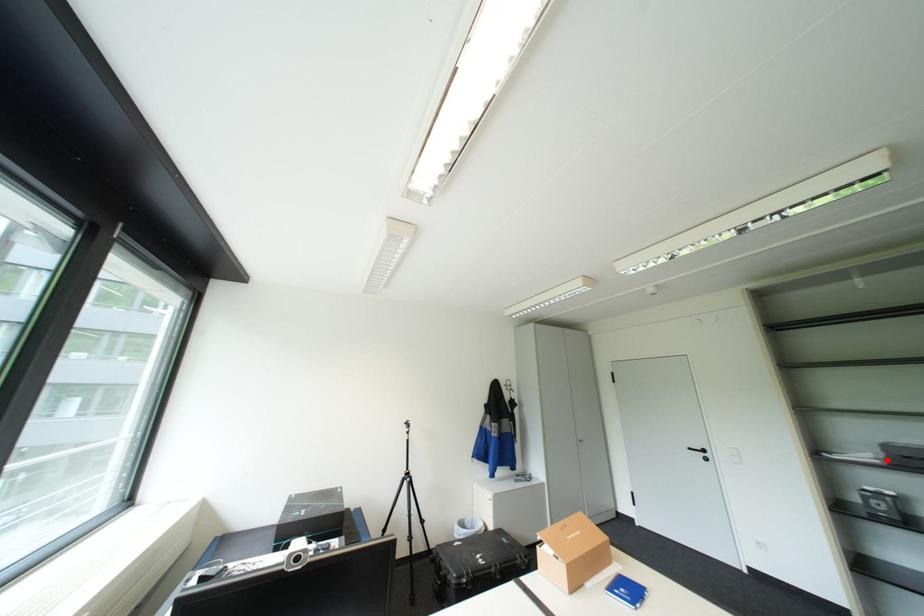
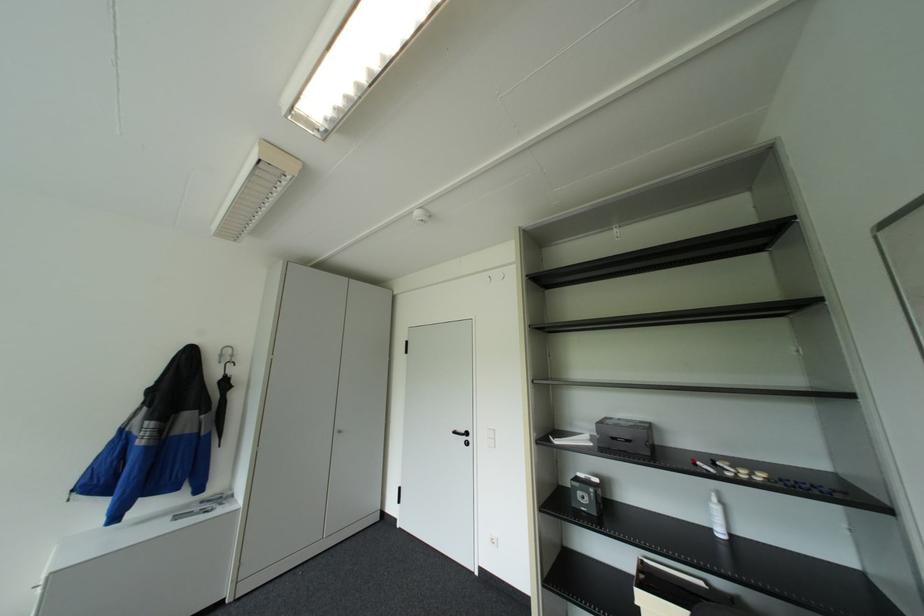
Question: I am providing you with two images of the same scene from different viewpoints. Image1 has a red point marked. In image2, the corresponding 3D location appears at what relative position? Reply with the corresponding letter.

Choices:
 (A) Closer
 (B) Farther

Answer: (B)